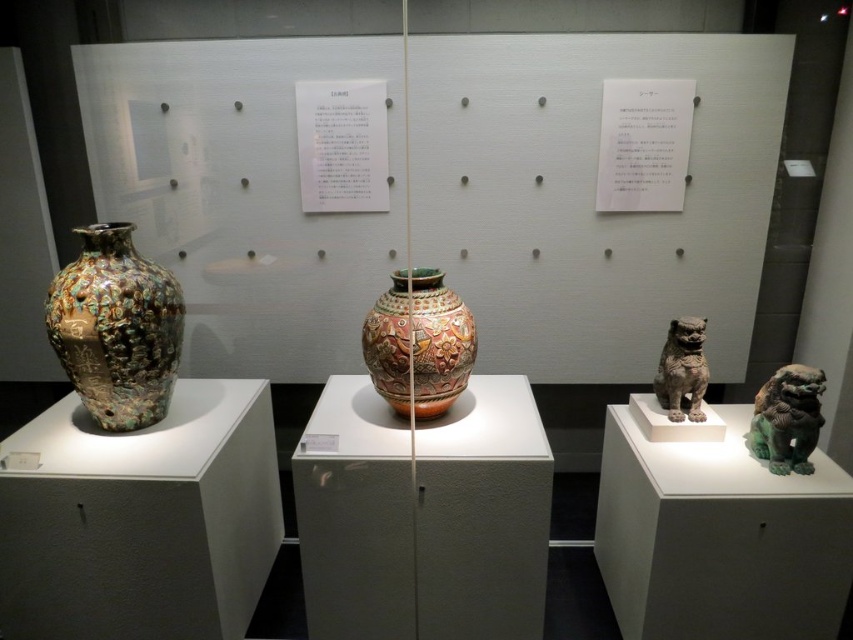
In the scene shown: Is white paper at center thinner than bronze statue at center right?

In fact, white paper at center might be wider than bronze statue at center right.

Is point (378, 273) closer to camera compared to point (674, 406)?

No, it is behind (674, 406).

The height and width of the screenshot is (640, 853). Describe the element at coordinates (590, 196) in the screenshot. I see `white paper at center` at that location.

You are a GUI agent. You are given a task and a screenshot of the screen. Output one action in this format:
    pyautogui.click(x=<x>, y=<y>)
    Task: Click on the white paper at center
    This screenshot has width=853, height=640.
    Given the screenshot: What is the action you would take?
    pyautogui.click(x=590, y=196)

Locate an element on the screen. This screenshot has width=853, height=640. multicolored glazed vase at center is located at coordinates (419, 342).

Can you confirm if white paper at center is positioned to the left of shiny multicolored vase at left?

No, white paper at center is not to the left of shiny multicolored vase at left.

This screenshot has height=640, width=853. What do you see at coordinates (590, 196) in the screenshot? I see `white paper at center` at bounding box center [590, 196].

Locate an element on the screen. This screenshot has width=853, height=640. white paper at center is located at coordinates (590, 196).